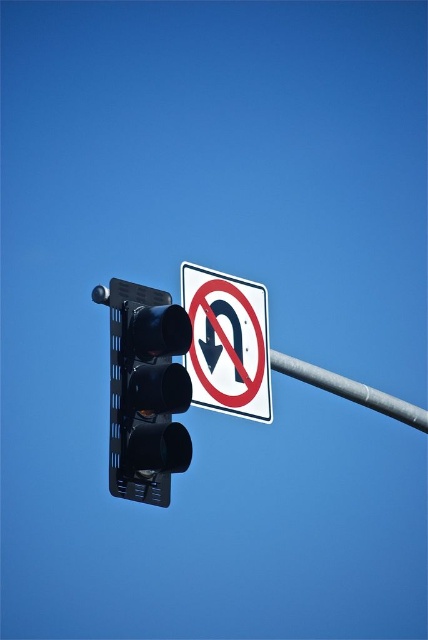
You are a pedestrian standing at the intersection and see the black matte traffic light at left and the metallic gray pole at center. Which object is positioned higher in the image?

The black matte traffic light at left is above the metallic gray pole at center, so it is positioned higher in the image.

You are standing at the point marked by the coordinates point (186, 330). You want to walk to a friend who is standing at the base of the traffic signal pole. The distance between you and your friend is 34.18 meters. If you walk directly towards the traffic signal pole, will you pass by the road sign on your way?

Yes, because the point (186, 330) is 34.18 meters away from the viewer, and the road sign is located to the right of the traffic signal, so walking directly towards the traffic signal pole would not pass by the road sign. Wait, the answer seems contradictory. Let me check again. The road sign is to the right of the traffic signal. If you walk directly towards the traffic signal pole, your path would be along the line connecting your position to the pole. Since the road sign is to the right of the pole, it

You are a pedestrian standing in front of the traffic signal and road sign. You notice the white plastic sign at upper center and the metallic gray pole at center. Which object is closer to you?

Result: The white plastic sign at upper center is closer to you because it is in front of the metallic gray pole at center.